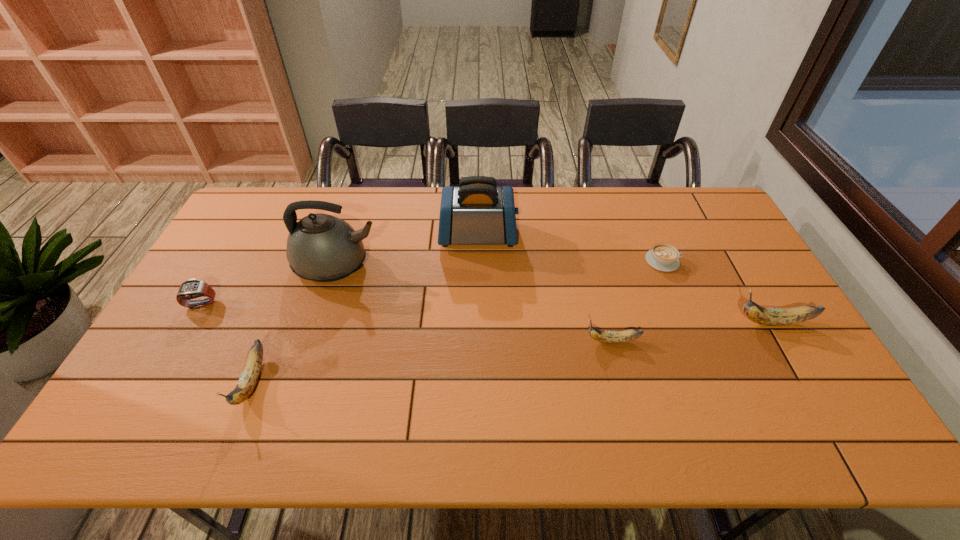
Find the location of a particular element. This screenshot has width=960, height=540. vacant space situated on the side of the cappuccino with the handle is located at coordinates (731, 261).

At what (x,y) coordinates should I click in order to perform the action: click on blank space located at the spout of the kettle. Please return your answer as a coordinate pair (x, y). Image resolution: width=960 pixels, height=540 pixels. Looking at the image, I should click on (468, 265).

In order to click on object that is at the far edge in this screenshot , I will do `click(477, 212)`.

Where is `object at the near edge`? object at the near edge is located at coordinates (249, 377).

At what (x,y) coordinates should I click in order to perform the action: click on object situated at the left edge. Please return your answer as a coordinate pair (x, y). The image size is (960, 540). Looking at the image, I should click on (190, 289).

You are a GUI agent. You are given a task and a screenshot of the screen. Output one action in this format:
    pyautogui.click(x=<x>, y=<y>)
    Task: Click on the object situated at the right edge
    This screenshot has width=960, height=540.
    Given the screenshot: What is the action you would take?
    pyautogui.click(x=765, y=316)

Locate an element on the screen. free space at the far edge of the desktop is located at coordinates (552, 205).

Locate an element on the screen. The image size is (960, 540). vacant point at the near edge is located at coordinates (676, 379).

In the image, there is a desktop. Where is `blank space at the left edge`? The width and height of the screenshot is (960, 540). blank space at the left edge is located at coordinates (232, 312).

The width and height of the screenshot is (960, 540). In the image, there is a desktop. Find the location of `free space at the right edge`. free space at the right edge is located at coordinates (752, 324).